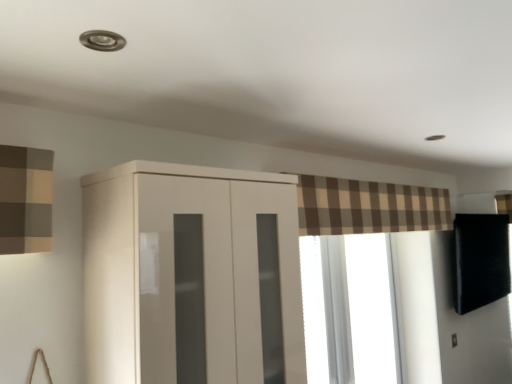
Question: Does brown plaid curtain at upper center have a greater height compared to glossy white cupboard at center?

Choices:
 (A) no
 (B) yes

Answer: (A)

Question: Is glossy white cupboard at center at the back of brown plaid curtain at upper center?

Choices:
 (A) no
 (B) yes

Answer: (A)

Question: Is brown plaid curtain at upper center further to camera compared to glossy white cupboard at center?

Choices:
 (A) yes
 (B) no

Answer: (A)

Question: Does brown plaid curtain at upper center have a lesser height compared to glossy white cupboard at center?

Choices:
 (A) no
 (B) yes

Answer: (B)

Question: Are brown plaid curtain at upper center and glossy white cupboard at center far apart?

Choices:
 (A) yes
 (B) no

Answer: (B)

Question: From the image's perspective, would you say brown plaid curtain at upper center is positioned over glossy white cupboard at center?

Choices:
 (A) yes
 (B) no

Answer: (A)

Question: Considering the relative sizes of glossy white cupboard at center and transparent glass window at center in the image provided, is glossy white cupboard at center taller than transparent glass window at center?

Choices:
 (A) no
 (B) yes

Answer: (A)

Question: Considering the relative sizes of glossy white cupboard at center and transparent glass window at center in the image provided, is glossy white cupboard at center bigger than transparent glass window at center?

Choices:
 (A) no
 (B) yes

Answer: (B)

Question: Is glossy white cupboard at center positioned behind transparent glass window at center?

Choices:
 (A) no
 (B) yes

Answer: (A)

Question: Does glossy white cupboard at center have a greater width compared to transparent glass window at center?

Choices:
 (A) no
 (B) yes

Answer: (B)

Question: Is glossy white cupboard at center smaller than transparent glass window at center?

Choices:
 (A) no
 (B) yes

Answer: (A)

Question: From a real-world perspective, is glossy white cupboard at center on top of transparent glass window at center?

Choices:
 (A) yes
 (B) no

Answer: (A)

Question: Is brown plaid curtain at upper center not inside transparent glass window at center?

Choices:
 (A) no
 (B) yes

Answer: (B)